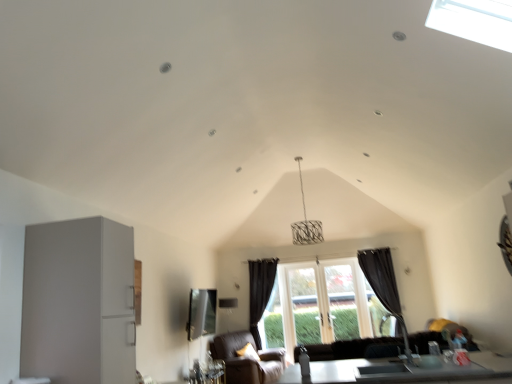
Question: From a real-world perspective, is transparent glass window at center on brown leather armchair at lower center?

Choices:
 (A) yes
 (B) no

Answer: (A)

Question: Is transparent glass window at center further to the viewer compared to brown leather armchair at lower center?

Choices:
 (A) yes
 (B) no

Answer: (A)

Question: From the image's perspective, is transparent glass window at center located above brown leather armchair at lower center?

Choices:
 (A) yes
 (B) no

Answer: (A)

Question: Does transparent glass window at center have a lesser width compared to brown leather armchair at lower center?

Choices:
 (A) yes
 (B) no

Answer: (A)

Question: Is transparent glass window at center wider than brown leather armchair at lower center?

Choices:
 (A) yes
 (B) no

Answer: (B)

Question: Is matte glass window screen at center in front of or behind black fabric curtain at right, placed as the second curtain when sorted from left to right, in the image?

Choices:
 (A) front
 (B) behind

Answer: (A)

Question: Considering the relative positions of matte glass window screen at center and black fabric curtain at right, placed as the second curtain when sorted from left to right, in the image provided, is matte glass window screen at center to the left or to the right of black fabric curtain at right, placed as the second curtain when sorted from left to right,?

Choices:
 (A) right
 (B) left

Answer: (B)

Question: Is matte glass window screen at center taller or shorter than black fabric curtain at right, placed as the 1th curtain when sorted from right to left?

Choices:
 (A) short
 (B) tall

Answer: (A)

Question: From the image's perspective, is matte glass window screen at center positioned above or below black fabric curtain at right, placed as the 1th curtain when sorted from right to left?

Choices:
 (A) above
 (B) below

Answer: (A)

Question: In terms of height, does metallic silver table at lower right look taller or shorter compared to black fabric curtain at center, which is counted as the first curtain, starting from the left?

Choices:
 (A) tall
 (B) short

Answer: (B)

Question: Do you think metallic silver table at lower right is within black fabric curtain at center, which ranks as the second curtain in right-to-left order, or outside of it?

Choices:
 (A) outside
 (B) inside

Answer: (A)

Question: From a real-world perspective, relative to black fabric curtain at center, which ranks as the second curtain in right-to-left order, is metallic silver table at lower right vertically above or below?

Choices:
 (A) above
 (B) below

Answer: (B)

Question: Based on their sizes in the image, would you say metallic silver table at lower right is bigger or smaller than black fabric curtain at center, which is counted as the first curtain, starting from the left?

Choices:
 (A) small
 (B) big

Answer: (B)

Question: Is point (350, 332) closer or farther from the camera than point (372, 281)?

Choices:
 (A) closer
 (B) farther

Answer: (B)

Question: Visually, is transparent glass window at center positioned to the left or to the right of black fabric curtain at right, placed as the second curtain when sorted from left to right?

Choices:
 (A) left
 (B) right

Answer: (A)